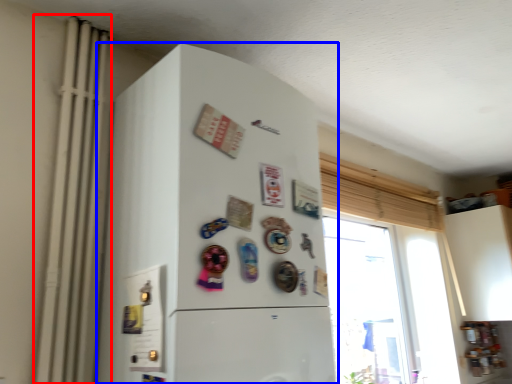
Question: Among these objects, which one is farthest to the camera, radiator (highlighted by a red box) or refrigerator (highlighted by a blue box)?

Choices:
 (A) radiator
 (B) refrigerator

Answer: (A)